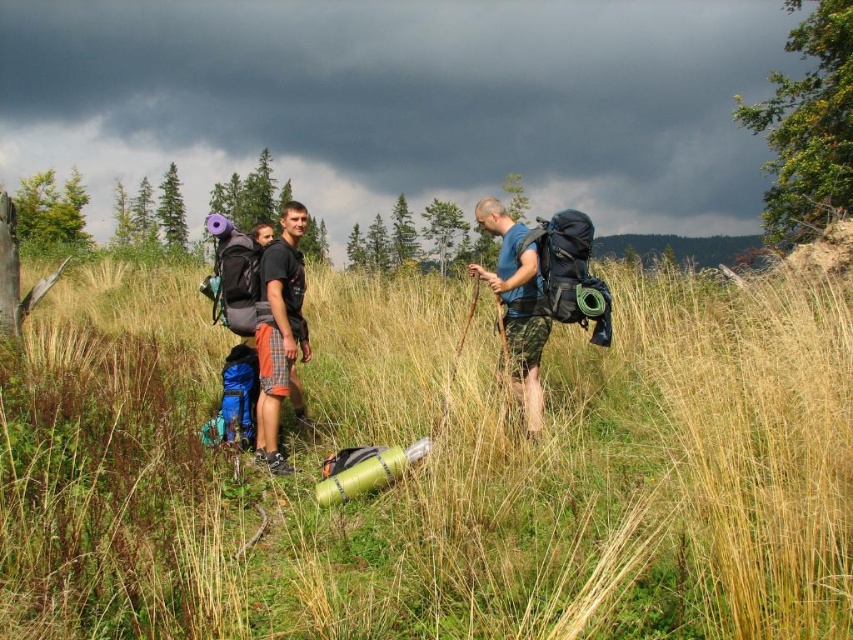
Identify the location of green grassy at center. This screenshot has height=640, width=853. (434, 472).

Describe the element at coordinates (434, 472) in the screenshot. I see `green grassy at center` at that location.

Identify the location of green grassy at center. (434, 472).

Is green grassy at center positioned before matte black t-shirt at center?

Yes, green grassy at center is closer to the viewer.

Can you confirm if green grassy at center is positioned above matte black t-shirt at center?

No.

Describe the element at coordinates (434, 472) in the screenshot. The width and height of the screenshot is (853, 640). I see `green grassy at center` at that location.

Locate an element on the screen. Image resolution: width=853 pixels, height=640 pixels. green grassy at center is located at coordinates (434, 472).

Measure the distance between matte black t-shirt at center and blue fabric backpack at center.

matte black t-shirt at center is 1.66 meters from blue fabric backpack at center.

Is point (286, 324) positioned after point (537, 417)?

No, (286, 324) is closer to viewer.

Locate an element on the screen. This screenshot has height=640, width=853. matte black t-shirt at center is located at coordinates (279, 330).